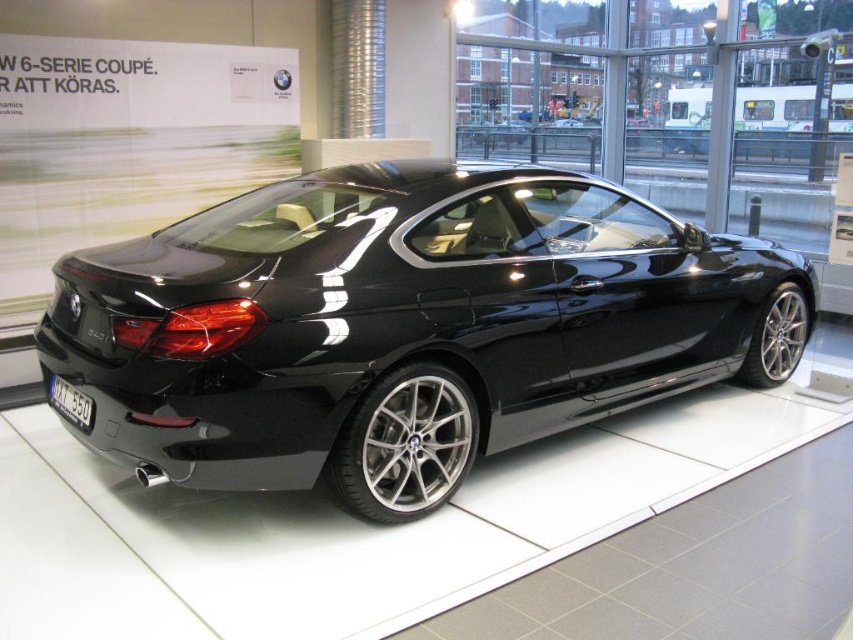
Is point (183, 445) positioned behind point (59, 404)?

No, it is in front of (59, 404).

Does glossy black car at center appear over black plastic license plate at rear?

Yes, glossy black car at center is above black plastic license plate at rear.

Identify the location of glossy black car at center. (405, 326).